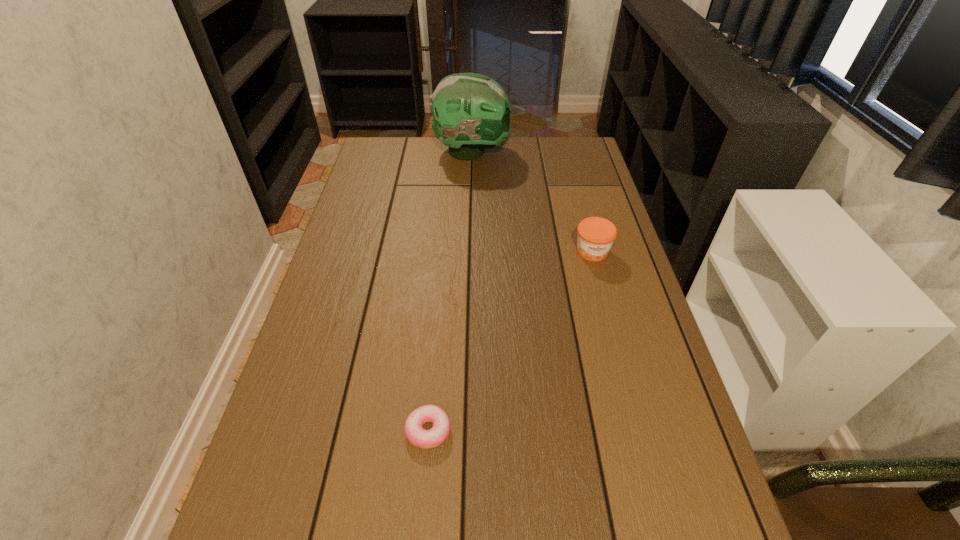
I want to click on vacant region between the football helmet and the second shortest object, so click(x=533, y=202).

Image resolution: width=960 pixels, height=540 pixels. In order to click on empty space between the rightmost object and the farthest object in this screenshot , I will do `click(533, 202)`.

You are a GUI agent. You are given a task and a screenshot of the screen. Output one action in this format:
    pyautogui.click(x=<x>, y=<y>)
    Task: Click on the vacant region between the nearest object and the second tallest object
    The image size is (960, 540).
    Given the screenshot: What is the action you would take?
    pyautogui.click(x=510, y=341)

Find the location of a particular element. vacant area that lies between the shortest object and the second nearest object is located at coordinates (510, 341).

I want to click on the second closest object to the football helmet, so click(413, 427).

Where is `object that is the second closest to the jam`? object that is the second closest to the jam is located at coordinates click(x=413, y=427).

Image resolution: width=960 pixels, height=540 pixels. In order to click on free space that satisfies the following two spatial constraints: 1. on the visor of the tallest object; 2. on the front side of the shortest object in this screenshot , I will do `click(466, 430)`.

What are the coordinates of `free space that satisfies the following two spatial constraints: 1. on the visor of the farthest object; 2. on the front side of the nearest object` in the screenshot? It's located at (466, 430).